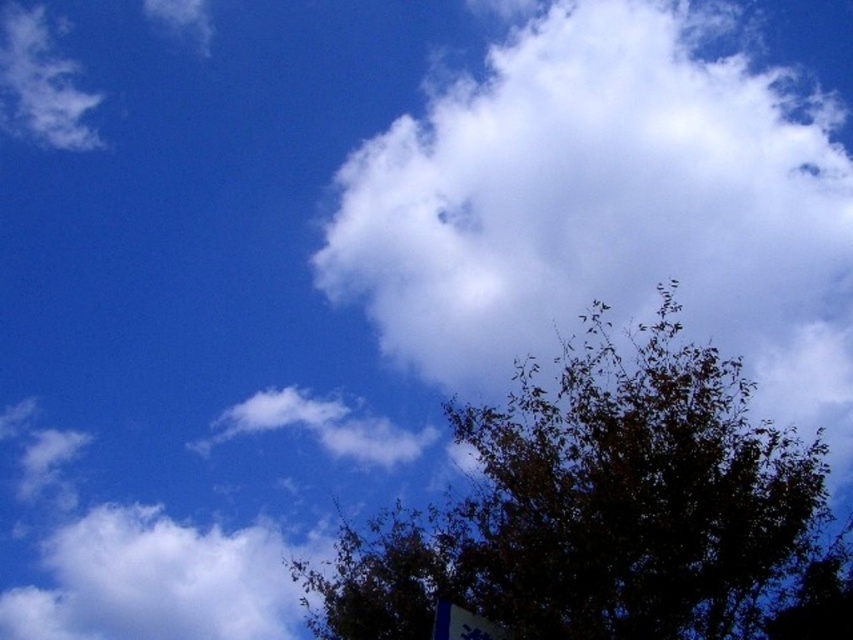
Question: Which point is closer to the camera?

Choices:
 (A) white fluffy cloud at upper center
 (B) dark green leafy tree at bottom right

Answer: (B)

Question: Where is dark green leafy tree at bottom right located in relation to white fluffy cloud at upper left in the image?

Choices:
 (A) above
 (B) below

Answer: (A)

Question: Which point appears farthest from the camera in this image?

Choices:
 (A) (502, 410)
 (B) (120, 570)

Answer: (B)

Question: Is dark green leafy tree at bottom right to the right of white fluffy cloud at upper left from the viewer's perspective?

Choices:
 (A) yes
 (B) no

Answer: (A)

Question: Which of the following is the closest to the observer?

Choices:
 (A) (738, 628)
 (B) (154, 532)
 (C) (560, 163)

Answer: (C)

Question: Does white fluffy cloud at upper center have a lesser width compared to dark green leafy tree at bottom right?

Choices:
 (A) no
 (B) yes

Answer: (A)